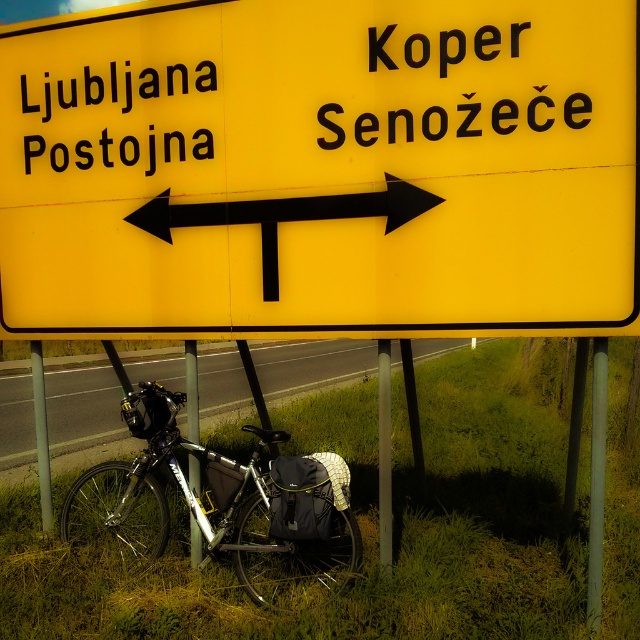
You are a cyclist planning to travel to Koper Senozece from the current location shown in the image. You see the metallic bicycle at lower left. Is the bicycle positioned to the left or right side of the road sign?

The metallic bicycle at lower left is located at point (369,522), which places it to the left side of the road sign.

You are a cyclist standing at the road sign and want to take a photo of the metallic silver bicycle at lower left with your smartphone. Considering the distance between you and the bicycle, will the bicycle appear large enough in the photo to clearly see its details?

The metallic silver bicycle at lower left is 4.18 meters from camera. At this distance, the bicycle may appear small in the photo, making it difficult to see details clearly. Move closer for a better shot.

You are a cyclist planning to attach a small GPS tracker to either the black matte arrow at center or the metallic silver pole at lower left. Which object would you choose if you want the tracker to be more noticeable from a distance?

The black matte arrow at center is larger in size than the metallic silver pole at lower left, so the tracker would be more noticeable on the black matte arrow at center due to its larger size.